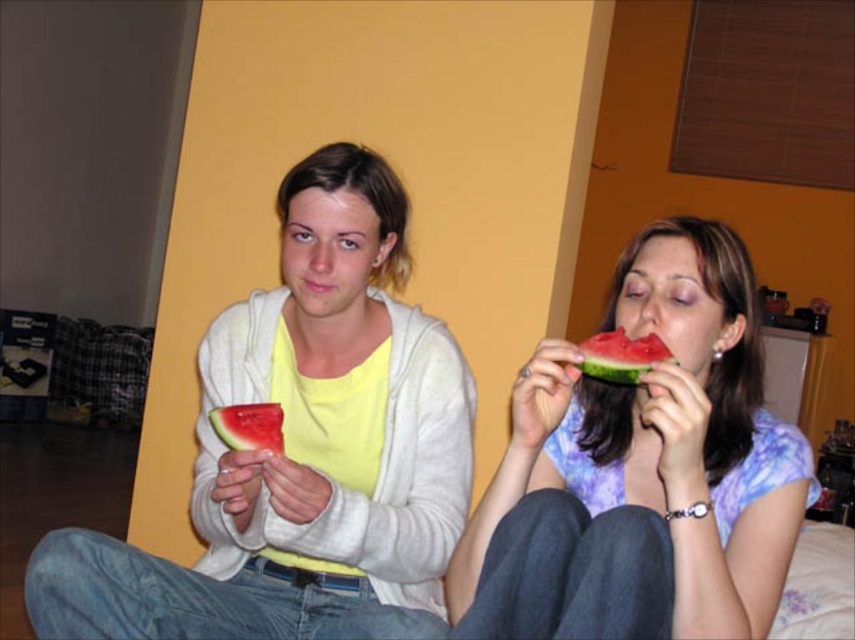
Question: Does matte yellow shirt at center have a larger size compared to watermelon at center?

Choices:
 (A) no
 (B) yes

Answer: (B)

Question: Is watermelon at center positioned behind juicy red watermelon at center?

Choices:
 (A) yes
 (B) no

Answer: (B)

Question: Does matte yellow shirt at center have a lesser width compared to matte purple shirt at right?

Choices:
 (A) yes
 (B) no

Answer: (B)

Question: Which object appears closest to the camera in this image?

Choices:
 (A) watermelon at center
 (B) juicy red watermelon at center
 (C) matte yellow shirt at center

Answer: (A)

Question: Among these points, which one is nearest to the camera?

Choices:
 (A) (620, 355)
 (B) (724, 458)
 (C) (423, 413)

Answer: (A)

Question: Estimate the real-world distances between objects in this image. Which object is farther from the juicy red watermelon at center?

Choices:
 (A) watermelon at center
 (B) matte purple shirt at right
 (C) matte yellow shirt at center

Answer: (B)